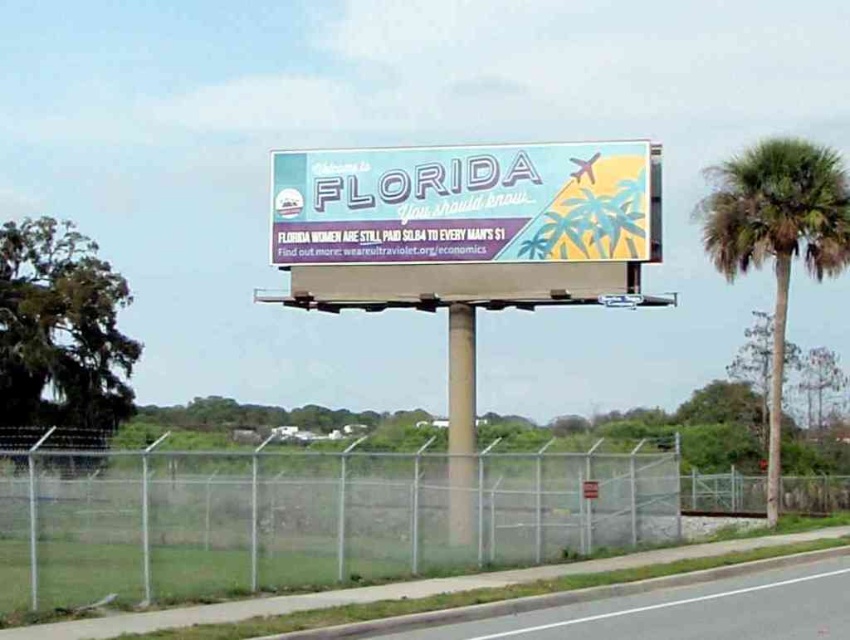
Question: Based on their relative distances, which object is farther from the green leafy palm tree at right?

Choices:
 (A) asphalt road at lower center
 (B) metal chain-link fence at center

Answer: (A)

Question: Which object appears closest to the camera in this image?

Choices:
 (A) pastel paper billboard at center
 (B) metal chain-link fence at center
 (C) asphalt road at lower center
 (D) green leafy palm tree at right

Answer: (C)

Question: Which object is closer to the camera taking this photo?

Choices:
 (A) asphalt road at lower center
 (B) metal chain-link fence at center
 (C) green leafy palm tree at right
 (D) pastel paper billboard at center

Answer: (A)

Question: Does pastel paper billboard at center appear on the left side of green leafy palm tree at right?

Choices:
 (A) no
 (B) yes

Answer: (B)

Question: Is metal chain-link fence at center to the right of pastel paper billboard at center from the viewer's perspective?

Choices:
 (A) no
 (B) yes

Answer: (B)

Question: Can you confirm if pastel paper billboard at center is positioned to the left of asphalt road at lower center?

Choices:
 (A) yes
 (B) no

Answer: (A)